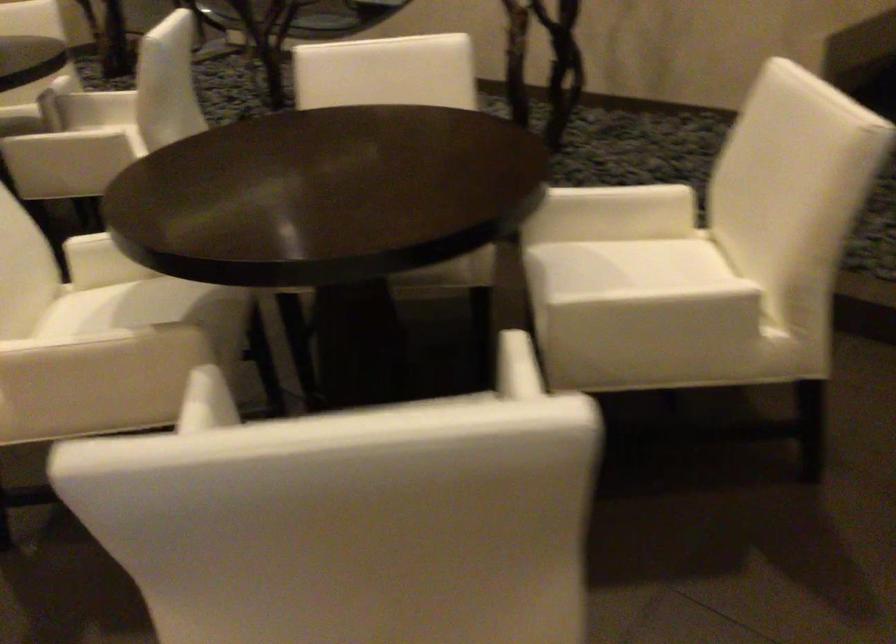
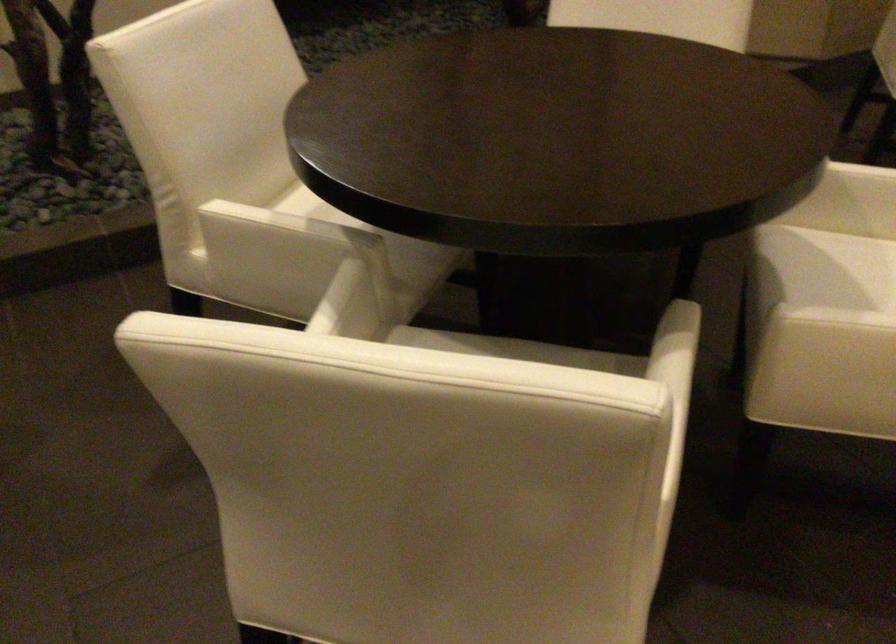
The point at (142, 342) is marked in the first image. Where is the corresponding point in the second image?

(688, 353)